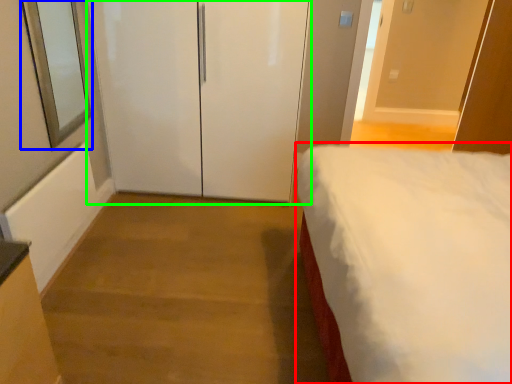
Question: Which object is positioned farthest from bed (highlighted by a red box)? Select from window screen (highlighted by a blue box) and door (highlighted by a green box).

Choices:
 (A) window screen
 (B) door

Answer: (A)